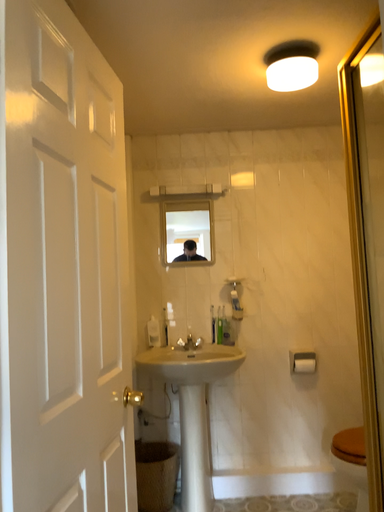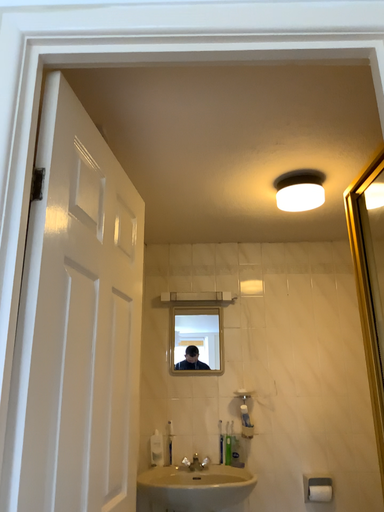
Question: Which way did the camera rotate in the video?

Choices:
 (A) rotated downward
 (B) rotated upward

Answer: (B)